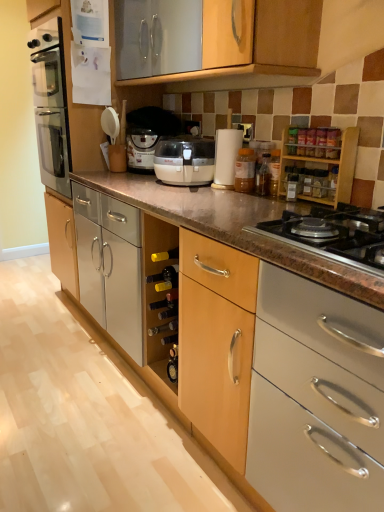
Question: Is matte white coffee machine at center bigger or smaller than black granite gas stove at lower right?

Choices:
 (A) big
 (B) small

Answer: (A)

Question: Is matte white coffee machine at center taller or shorter than black granite gas stove at lower right?

Choices:
 (A) short
 (B) tall

Answer: (B)

Question: Which is nearer to the wooden cabinet at lower center, which is the second cabinetry in right-to-left order?

Choices:
 (A) translucent plastic jar at center
 (B) black granite gas stove at lower right
 (C) matte white coffee machine at center
 (D) wooden spice rack at upper right, the second cabinetry positioned from the left

Answer: (B)

Question: Which is nearer to the wooden cabinet at lower center, positioned as the first cabinetry in bottom-to-top order?

Choices:
 (A) matte white coffee machine at center
 (B) translucent plastic jar at center
 (C) black granite gas stove at lower right
 (D) wooden spice rack at upper right, the first cabinetry from the right

Answer: (C)